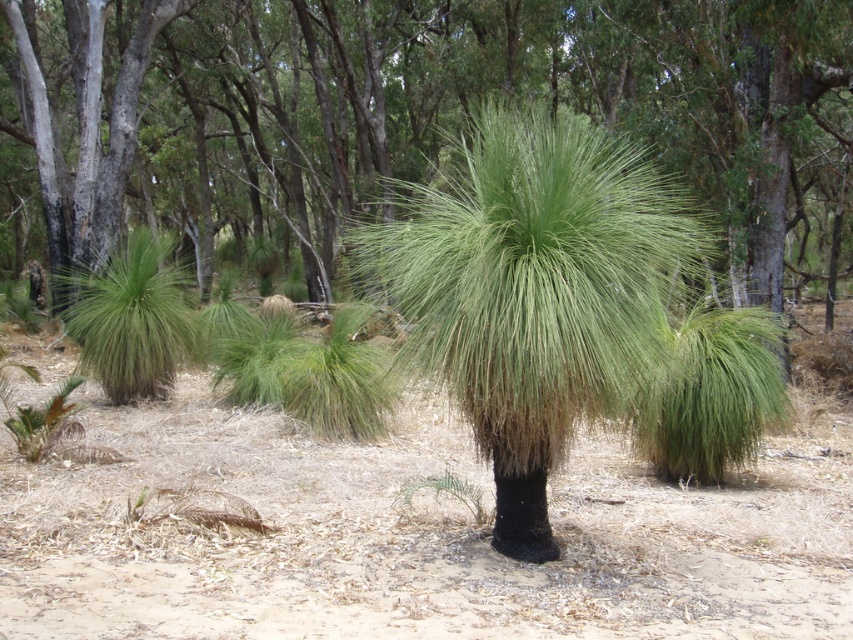
Question: Among these points, which one is nearest to the camera?

Choices:
 (A) (122, 376)
 (B) (798, 45)

Answer: (A)

Question: Considering the real-world distances, which object is closest to the green fibrous plant at center?

Choices:
 (A) green fibrous palm tree at left
 (B) green fibrous palm tree at center
 (C) brown dry dirt at center

Answer: (B)

Question: Can you confirm if green fibrous plant at center is positioned below brown dry dirt at center?

Choices:
 (A) yes
 (B) no

Answer: (B)

Question: Is green fibrous plant at center in front of green fibrous palm tree at left?

Choices:
 (A) no
 (B) yes

Answer: (A)

Question: Does green fibrous plant at center appear under brown dry dirt at center?

Choices:
 (A) yes
 (B) no

Answer: (B)

Question: Based on their relative distances, which object is farther from the brown dry dirt at center?

Choices:
 (A) green fibrous palm tree at left
 (B) green fibrous palm tree at center

Answer: (A)